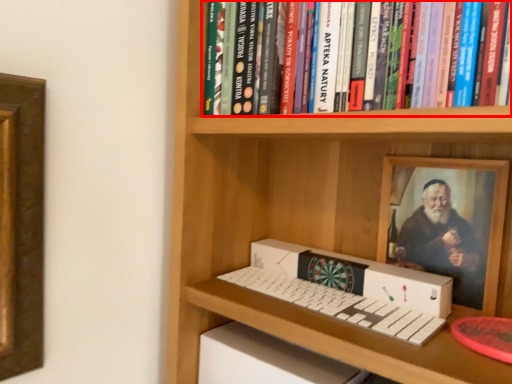
Question: From the image, what is the correct spatial relationship of book (annotated by the red box) in relation to box?

Choices:
 (A) left
 (B) right

Answer: (A)